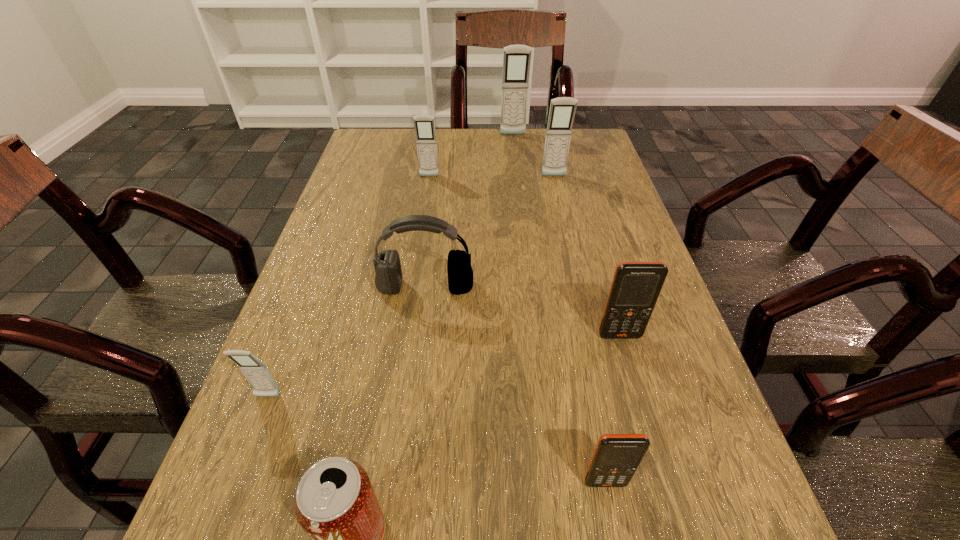
The image size is (960, 540). Identify the location of free space between the black headset and the tallest cellular telephone. (469, 211).

At what (x,y) coordinates should I click in order to perform the action: click on blank region between the third biggest gray cellular telephone and the smallest gray cellular telephone. Please return your answer as a coordinate pair (x, y). Looking at the image, I should click on (348, 287).

You are a GUI agent. You are given a task and a screenshot of the screen. Output one action in this format:
    pyautogui.click(x=<x>, y=<y>)
    Task: Click on the vacant space that is in between the black headset and the fifth shortest cellular telephone
    
    Given the screenshot: What is the action you would take?
    pyautogui.click(x=490, y=232)

The width and height of the screenshot is (960, 540). I want to click on unoccupied area between the biggest gray cellular telephone and the seventh shortest object, so click(534, 156).

At what (x,y) coordinates should I click in order to perform the action: click on the closest object relative to the third gray cellular telephone from left to right. Please return your answer as a coordinate pair (x, y). This screenshot has height=540, width=960. Looking at the image, I should click on (562, 110).

Locate which object is the closest to the red soda can. Please provide its 2D coordinates. Your answer should be formatted as a tuple, i.e. [(x, y)], where the tuple contains the x and y coordinates of a point satisfying the conditions above.

[(257, 374)]

Select which cellular telephone appears as the fourth closest to the nearer orange cellular telephone. Please provide its 2D coordinates. Your answer should be formatted as a tuple, i.e. [(x, y)], where the tuple contains the x and y coordinates of a point satisfying the conditions above.

[(424, 125)]

Locate which cellular telephone ranks in proximity to the third smallest gray cellular telephone. Please provide its 2D coordinates. Your answer should be formatted as a tuple, i.e. [(x, y)], where the tuple contains the x and y coordinates of a point satisfying the conditions above.

[(516, 58)]

Locate which gray cellular telephone is the third closest to the fourth farthest object. Please provide its 2D coordinates. Your answer should be formatted as a tuple, i.e. [(x, y)], where the tuple contains the x and y coordinates of a point satisfying the conditions above.

[(562, 110)]

Select which gray cellular telephone is the closest to the nearer orange cellular telephone. Please provide its 2D coordinates. Your answer should be formatted as a tuple, i.e. [(x, y)], where the tuple contains the x and y coordinates of a point satisfying the conditions above.

[(257, 374)]